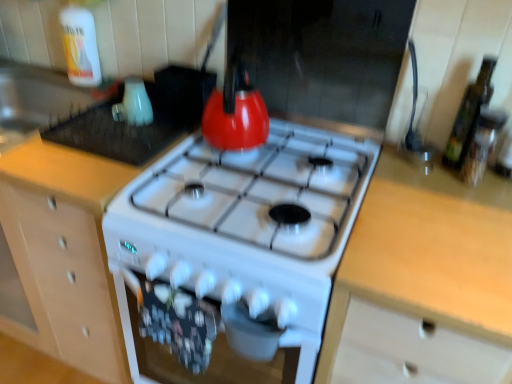
Locate an element on the screen. This screenshot has width=512, height=384. free space on the front side of white glossy kettle at upper left, the 1th appliance when ordered from left to right is located at coordinates [111, 141].